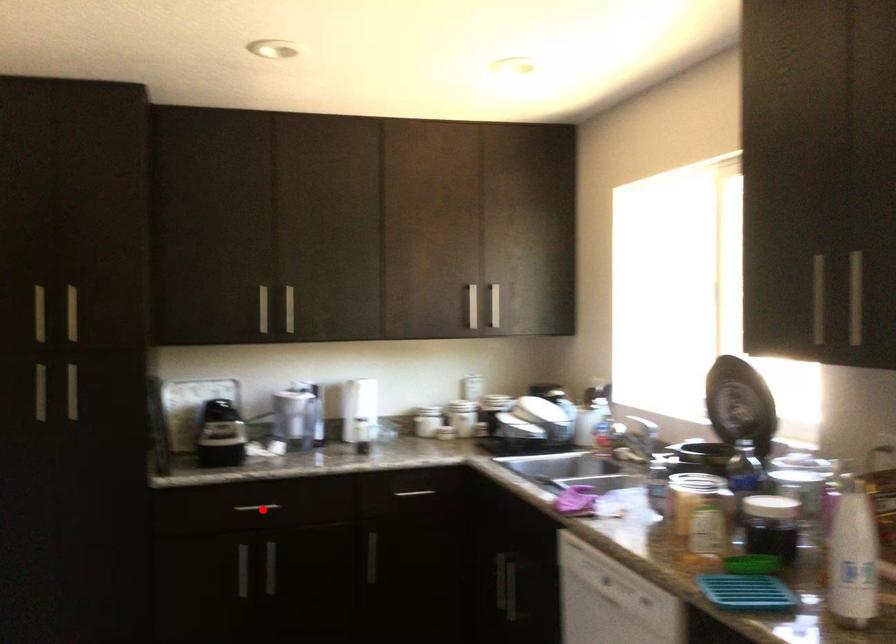
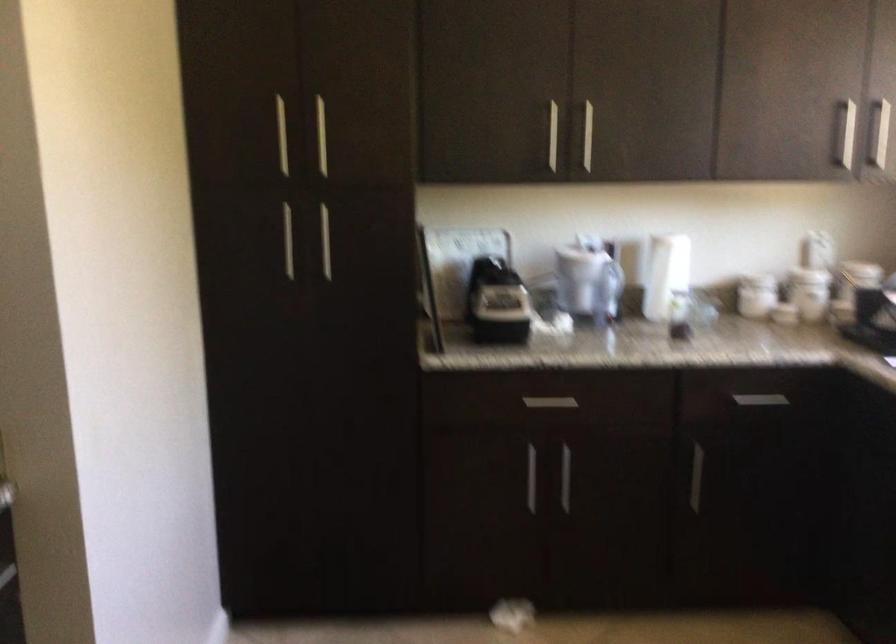
In the second image, find the point that corresponds to the highlighted location in the first image.

(549, 402)